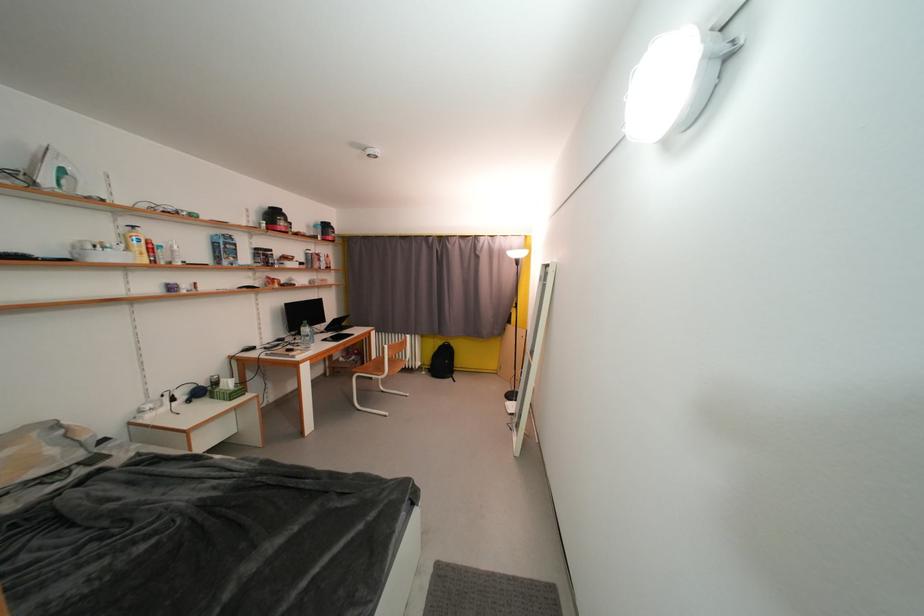
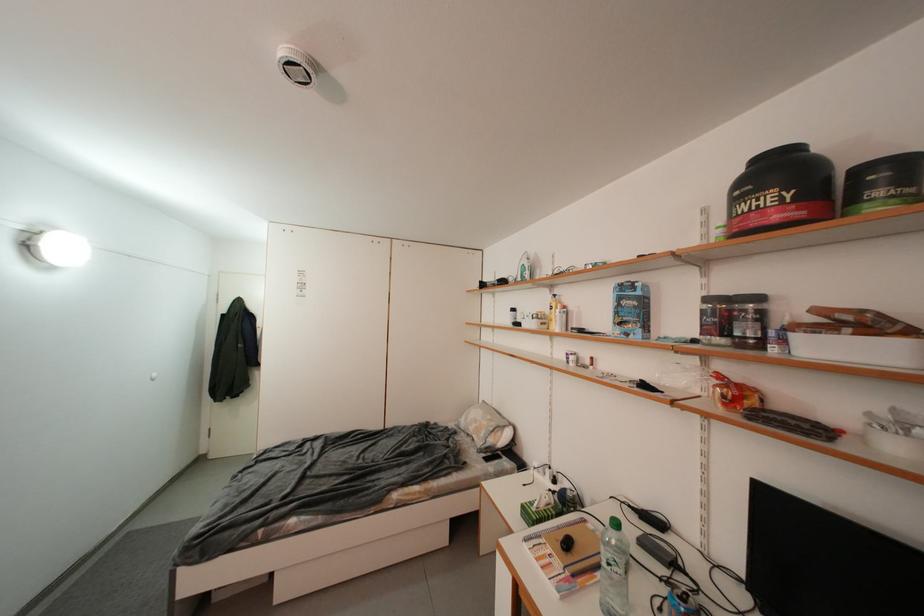
Where in the second image is the point corresponding to point 277,254 from the first image?

(766, 301)